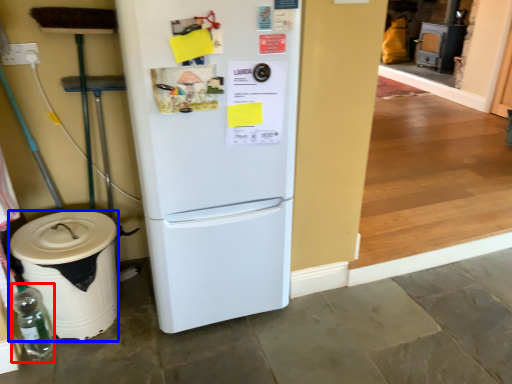
Question: Which point is further to the camera, bottle (highlighted by a red box) or trash bin/can (highlighted by a blue box)?

Choices:
 (A) bottle
 (B) trash bin/can

Answer: (A)